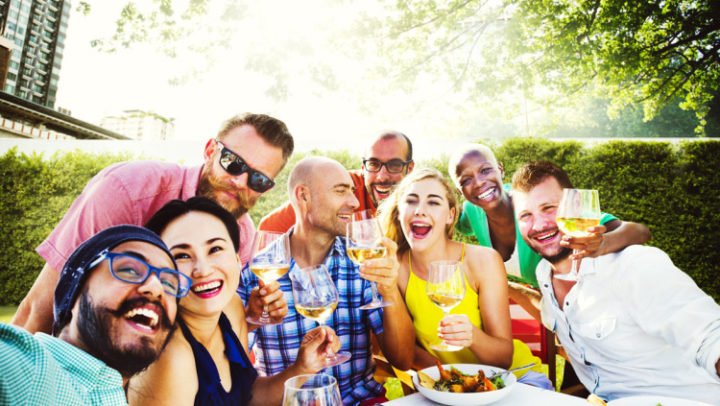
Where is `wine glasses`? This screenshot has height=406, width=720. wine glasses is located at coordinates (569, 218), (441, 280), (369, 244), (317, 298), (274, 263).